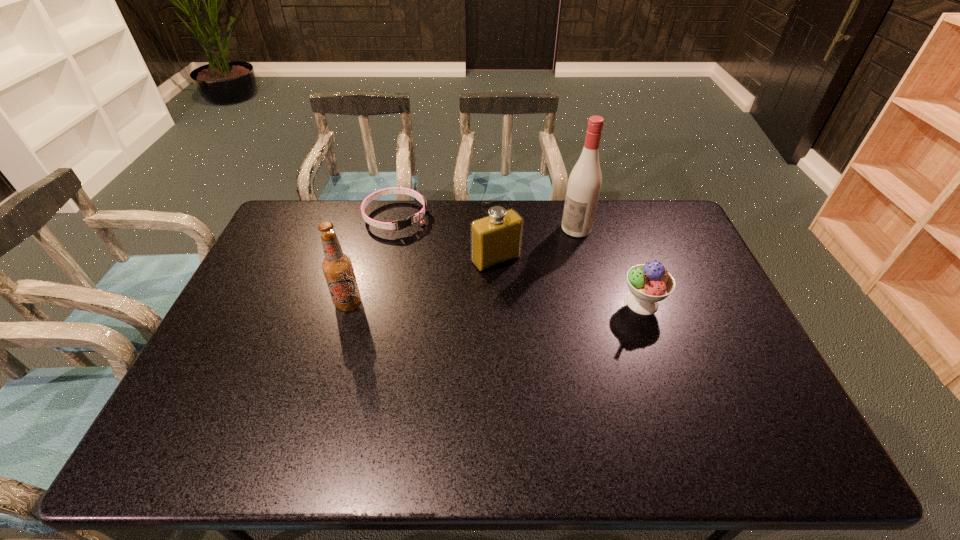
Where is `the fourth shortest object`? This screenshot has width=960, height=540. the fourth shortest object is located at coordinates coord(337,267).

Locate an element on the screen. Image resolution: width=960 pixels, height=540 pixels. icecream is located at coordinates (649, 283).

The height and width of the screenshot is (540, 960). Identify the location of the rightmost object. (649, 283).

At what (x,y) coordinates should I click in order to perform the action: click on the third nearest object. Please return your answer as a coordinate pair (x, y). The height and width of the screenshot is (540, 960). Looking at the image, I should click on (496, 239).

Where is `the third object from right to left`? the third object from right to left is located at coordinates (496, 239).

Where is `dog collar`? The width and height of the screenshot is (960, 540). dog collar is located at coordinates (402, 223).

Where is `the tallest object`? the tallest object is located at coordinates pyautogui.click(x=584, y=184).

Locate an element on the screen. alcohol is located at coordinates (584, 184).

Find the location of `free spot located on the front label of the beer bottle`. free spot located on the front label of the beer bottle is located at coordinates (339, 336).

At what (x,y) coordinates should I click in order to perform the action: click on vacant position located 0.210m on the back of the fourth tallest object. Please return your answer as a coordinate pair (x, y). Looking at the image, I should click on (621, 245).